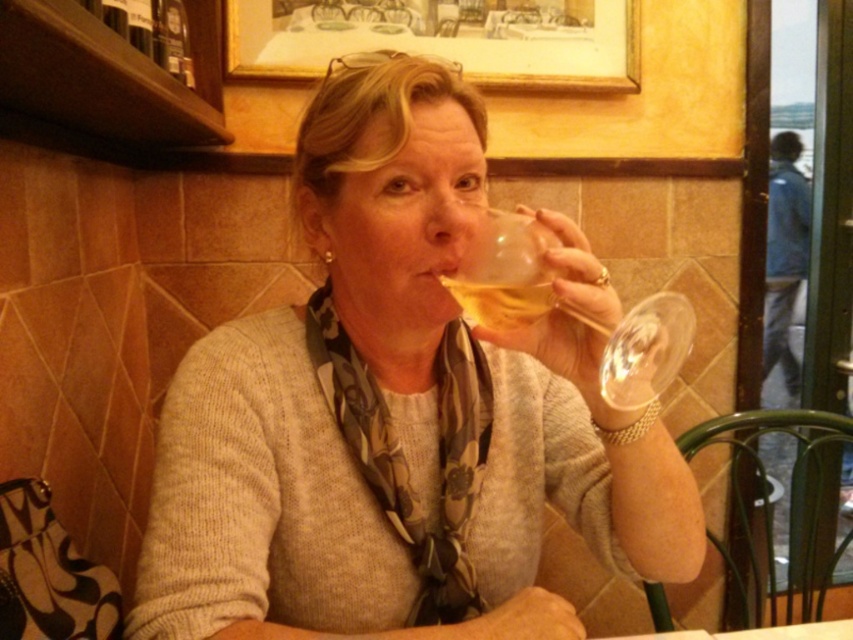
From the picture: You are an interior designer assessing the space between two objects in the scene. The wooden frame at upper center and the transparent glass at upper center are both at the same height. Which object has a greater width?

The wooden frame at upper center has a greater width than the transparent glass at upper center, as stated in the description that the wooden frame at upper center surpasses the transparent glass at upper center in width.

You are standing in a restaurant and want to take a photo of the point at coordinates (297, 28). The camera you are using has a minimum focus distance of 1.6 meters. Will the camera be able to focus on the point?

The point at coordinates (297, 28) is 1.59 meters from the camera, which is slightly closer than the minimum focus distance of 1.6 meters. Therefore, the camera may not be able to focus on the point.

You are a waiter in a restaurant and you see the transparent glass at upper center and the golden translucent wine glass at upper center. The customer wants to pour a drink into the larger container. Which one should you choose?

The transparent glass at upper center is bigger than the golden translucent wine glass at upper center, so you should choose the transparent glass at upper center.